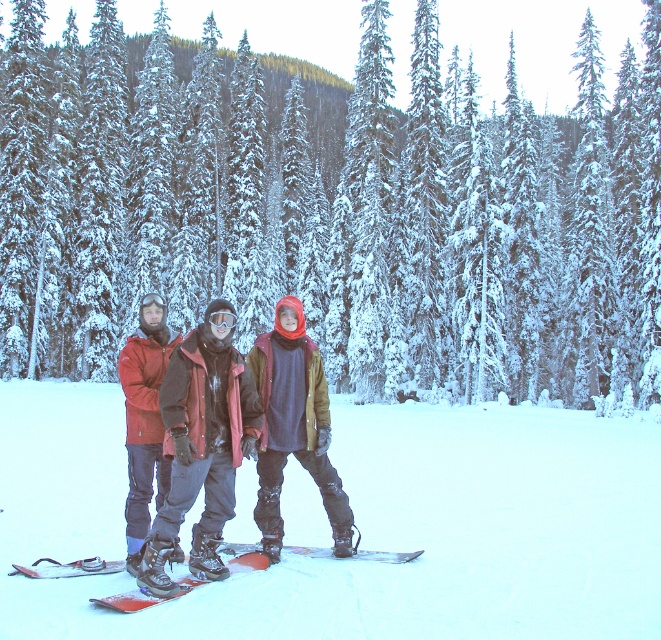
Which of these two, matte black snowboard at center or orange matte snowboard at center, stands shorter?

orange matte snowboard at center

Describe the element at coordinates (293, 426) in the screenshot. I see `matte black snowboard at center` at that location.

Image resolution: width=661 pixels, height=640 pixels. Identify the location of matte black snowboard at center. (293, 426).

Between point (202, 454) and point (202, 580), which one is positioned in front?

Positioned in front is point (202, 454).

Between point (149, 557) and point (173, 564), which one is positioned in front?

Point (149, 557) is in front.

The height and width of the screenshot is (640, 661). I want to click on matte snowboarders at center, so click(x=202, y=444).

Does point (369, 193) lie in front of point (136, 598)?

No, it is behind (136, 598).

Which is behind, point (646, 172) or point (249, 570)?

The point (646, 172) is more distant.

Find the location of a particular element. This screenshot has height=640, width=661. snow-covered pine tree at center is located at coordinates 332,211.